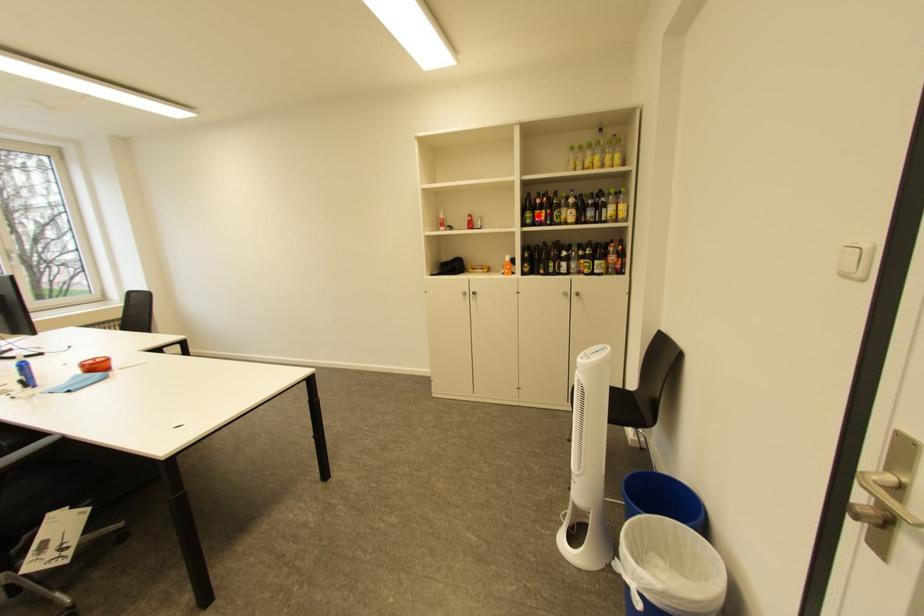
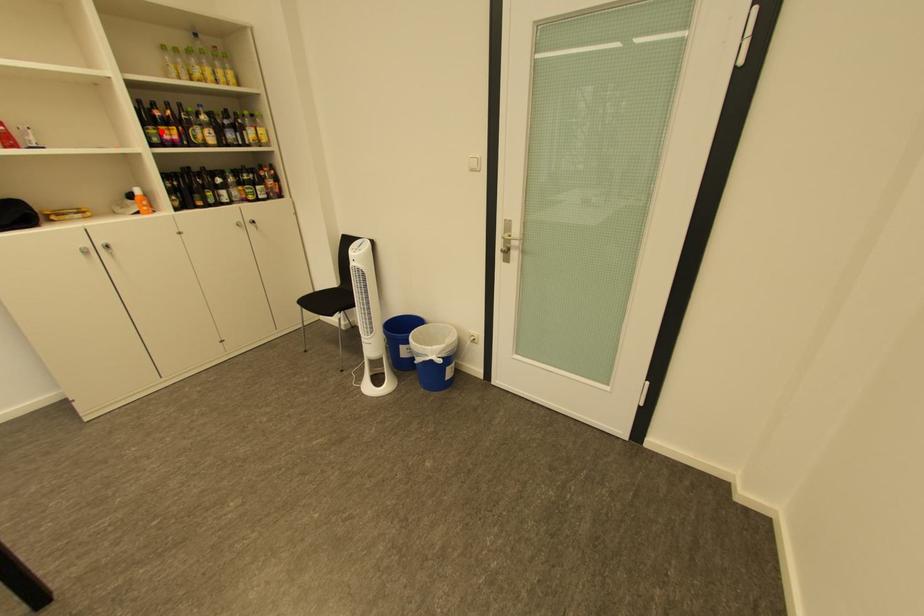
I am providing you with two images of the same scene from different viewpoints. A red point is marked on the first image and another point is marked on the second image. Do the highlighted points in image1 and image2 indicate the same real-world spot?

Yes